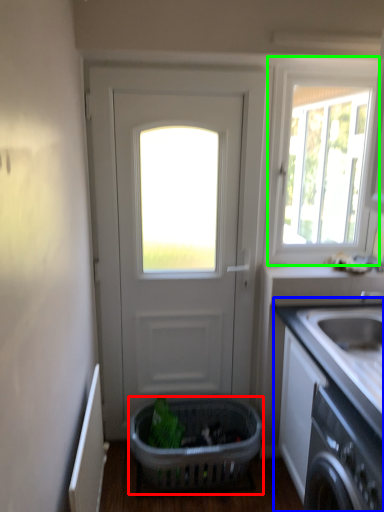
Question: Based on their relative distances, which object is nearer to basket (highlighted by a red box)? Choose from countertop (highlighted by a blue box) and window (highlighted by a green box).

Choices:
 (A) countertop
 (B) window

Answer: (A)